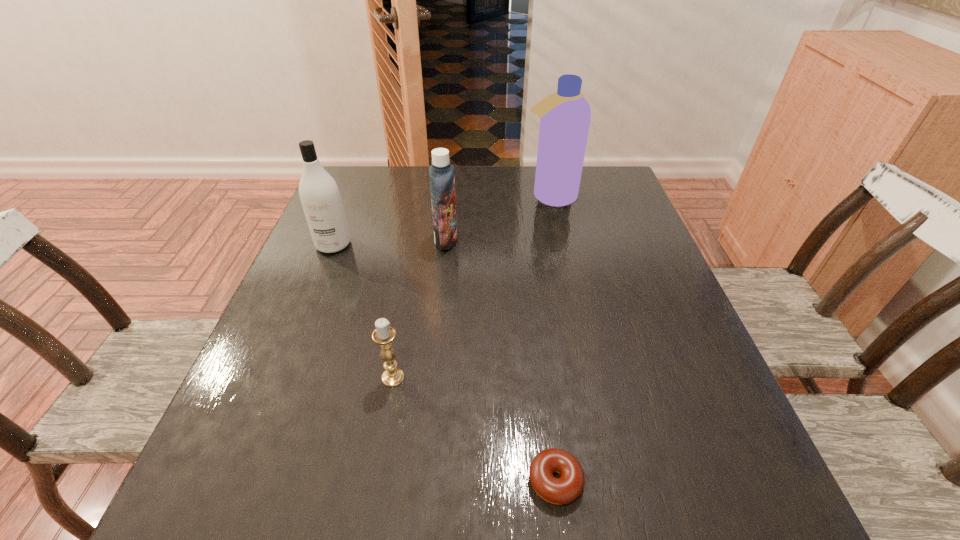
At what (x,y) coordinates should I click in order to perform the action: click on free space at the left edge of the desktop. Please return your answer as a coordinate pair (x, y). The image size is (960, 540). Looking at the image, I should click on (294, 364).

Image resolution: width=960 pixels, height=540 pixels. Find the location of `free space at the right edge of the desktop`. free space at the right edge of the desktop is located at coordinates (677, 441).

Find the location of a particular element. vacant space at the far left corner of the desktop is located at coordinates (376, 168).

Locate an element on the screen. This screenshot has height=540, width=960. vacant point located between the tallest shampoo and the second shampoo from right to left is located at coordinates (498, 219).

Where is `vacant area that lies between the third object from right to left and the leftmost shampoo`? The height and width of the screenshot is (540, 960). vacant area that lies between the third object from right to left and the leftmost shampoo is located at coordinates (x=390, y=242).

Locate an element on the screen. Image resolution: width=960 pixels, height=540 pixels. free space between the shortest object and the third object from left to right is located at coordinates pyautogui.click(x=501, y=360).

Identify the location of empty space that is in between the nearest object and the farthest shampoo. The height and width of the screenshot is (540, 960). (553, 339).

Identify the location of empty location between the second shampoo from left to right and the farthest object. The image size is (960, 540). (498, 219).

You are a GUI agent. You are given a task and a screenshot of the screen. Output one action in this format:
    pyautogui.click(x=<x>, y=<y>)
    Task: Click on the vacant space in between the nearest object and the tallest object
    This screenshot has height=540, width=960.
    Given the screenshot: What is the action you would take?
    pyautogui.click(x=553, y=339)

The height and width of the screenshot is (540, 960). In order to click on vacant area between the leftmost shampoo and the second nearest object in this screenshot , I will do `click(363, 311)`.